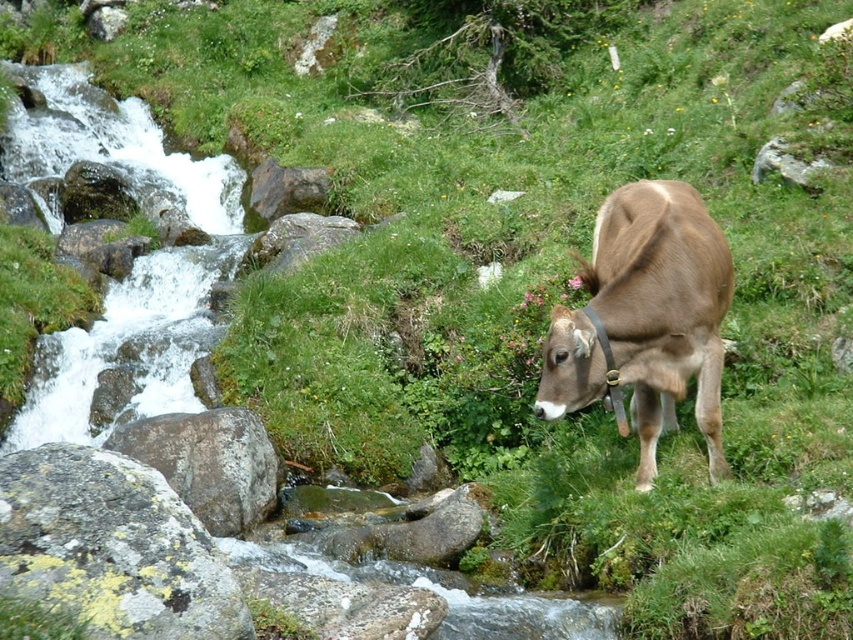
You are standing in the serene natural scene with the cow and the rocky stream. There are two points marked in the image. The first point is at coordinate point (567, 323) and the second is at point (16, 588). If you were to walk towards both points, which point would you reach first?

Point (16, 588) is closer to you than point (567, 323), so you would reach point (16, 588) first.

Looking at this image, you are a hiker who wants to cross the stream but needs to place the speckled gray rock at left and the gray rock at upper right to form a stepping stone path. How far apart should you space them to match the natural arrangement shown in the image?

The speckled gray rock at left and the gray rock at upper right should be spaced 7.42 meters apart to match the natural arrangement shown in the image.